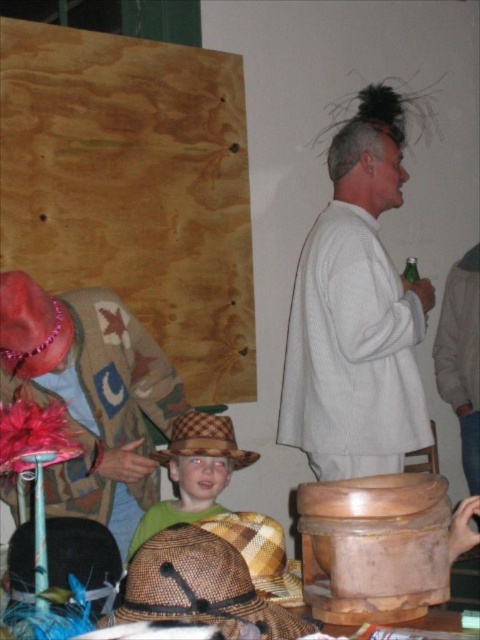
Question: Is woven straw cowboy hat at lower center above brown woven hat at center?

Choices:
 (A) yes
 (B) no

Answer: (A)

Question: Among these objects, which one is farthest from the camera?

Choices:
 (A) white knitted sweater at center
 (B) brown woven straw hat at lower center
 (C) woven straw cowboy hat at center

Answer: (A)

Question: Does knitted wool sweater at center lie behind woven straw cowboy hat at center?

Choices:
 (A) yes
 (B) no

Answer: (B)

Question: Estimate the real-world distances between objects in this image. Which object is farther from the woven straw cowboy hat at lower center?

Choices:
 (A) brown woven hat at center
 (B) white knitted sweater at center
 (C) knitted wool sweater at center
 (D) woven straw cowboy hat at center

Answer: (B)

Question: Can you confirm if woven straw cowboy hat at lower center is thinner than brown woven hat at center?

Choices:
 (A) no
 (B) yes

Answer: (B)

Question: Which object appears farthest from the camera in this image?

Choices:
 (A) brown woven straw hat at lower center
 (B) knitted wool sweater at center

Answer: (B)